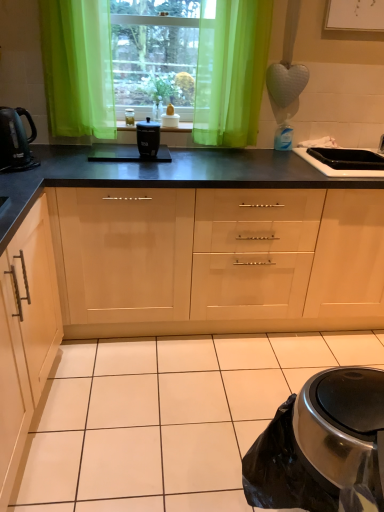
Question: Is green sheer curtain at center at the back of black glossy sink at right?

Choices:
 (A) yes
 (B) no

Answer: (B)

Question: Can you confirm if black glossy sink at right is taller than green sheer curtain at center?

Choices:
 (A) yes
 (B) no

Answer: (B)

Question: Is black glossy sink at right facing towards green sheer curtain at center?

Choices:
 (A) yes
 (B) no

Answer: (B)

Question: Can you confirm if black glossy sink at right is positioned to the right of green sheer curtain at center?

Choices:
 (A) no
 (B) yes

Answer: (B)

Question: Is green sheer curtain at center surrounded by black glossy sink at right?

Choices:
 (A) yes
 (B) no

Answer: (B)

Question: Does black glossy sink at right have a larger size compared to green sheer curtain at center?

Choices:
 (A) no
 (B) yes

Answer: (A)

Question: Is black plastic container at center not near translucent green curtain at center?

Choices:
 (A) no
 (B) yes

Answer: (A)

Question: Does black plastic container at center lie in front of translucent green curtain at center?

Choices:
 (A) no
 (B) yes

Answer: (A)

Question: Does black plastic container at center contain translucent green curtain at center?

Choices:
 (A) no
 (B) yes

Answer: (A)

Question: From the image's perspective, is black plastic container at center above translucent green curtain at center?

Choices:
 (A) yes
 (B) no

Answer: (B)

Question: Can you confirm if black plastic container at center is bigger than translucent green curtain at center?

Choices:
 (A) no
 (B) yes

Answer: (A)

Question: From a real-world perspective, is black plastic container at center positioned over translucent green curtain at center based on gravity?

Choices:
 (A) no
 (B) yes

Answer: (A)

Question: Is black matte slow cooker at center thinner than shiny black kettle at left?

Choices:
 (A) yes
 (B) no

Answer: (A)